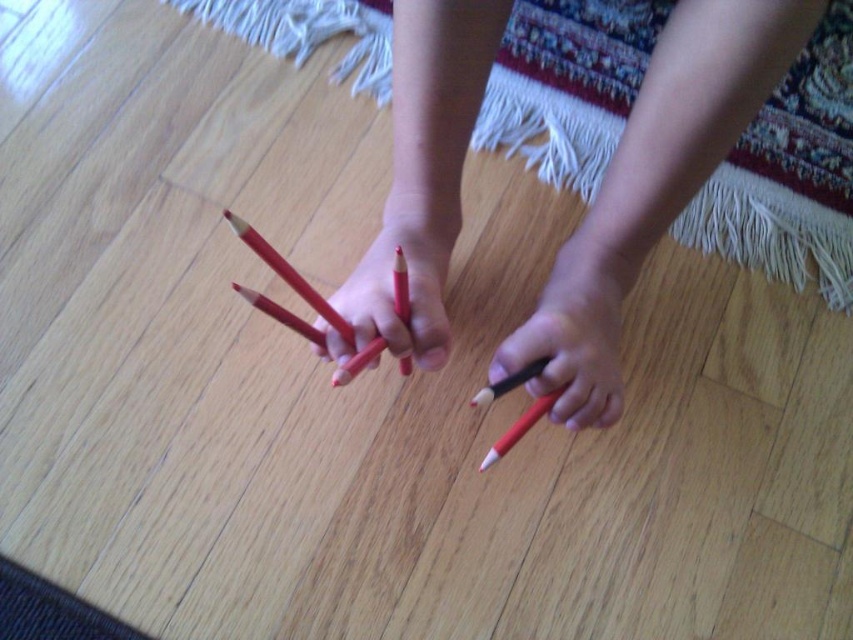
Question: Is the position of matte wood pencil at center less distant than that of matte black pencil at lower center?

Choices:
 (A) no
 (B) yes

Answer: (B)

Question: Is matte black pencil at lower center wider than matte red pencil at center?

Choices:
 (A) yes
 (B) no

Answer: (A)

Question: Which object appears closest to the camera in this image?

Choices:
 (A) matte red pencil at center
 (B) matte black pencil at lower center

Answer: (A)

Question: Can you confirm if matte black pencil at lower center is positioned above matte red pencil at center?

Choices:
 (A) no
 (B) yes

Answer: (A)

Question: Which point appears farthest from the camera in this image?

Choices:
 (A) (387, 276)
 (B) (512, 349)

Answer: (A)

Question: Which point appears farthest from the camera in this image?

Choices:
 (A) (361, 292)
 (B) (431, 330)
 (C) (602, 394)

Answer: (C)